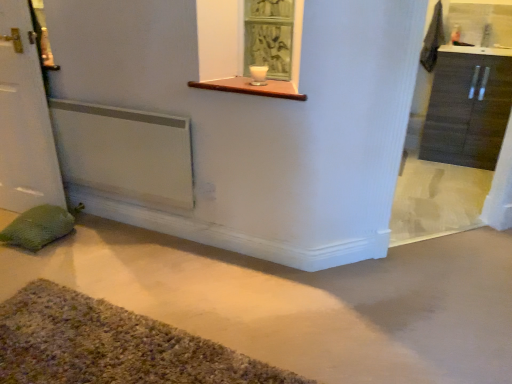
Question: From a real-world perspective, is white ceramic bowl at upper center physically below multicolored shaggy bath mat at lower left?

Choices:
 (A) no
 (B) yes

Answer: (A)

Question: Considering the relative sizes of white ceramic bowl at upper center and multicolored shaggy bath mat at lower left in the image provided, is white ceramic bowl at upper center thinner than multicolored shaggy bath mat at lower left?

Choices:
 (A) yes
 (B) no

Answer: (A)

Question: Is white ceramic bowl at upper center behind multicolored shaggy bath mat at lower left?

Choices:
 (A) no
 (B) yes

Answer: (B)

Question: From a real-world perspective, is white ceramic bowl at upper center on multicolored shaggy bath mat at lower left?

Choices:
 (A) no
 (B) yes

Answer: (B)

Question: Is white ceramic bowl at upper center completely or partially outside of multicolored shaggy bath mat at lower left?

Choices:
 (A) no
 (B) yes

Answer: (B)

Question: Is white ceramic bowl at upper center to the left of multicolored shaggy bath mat at lower left from the viewer's perspective?

Choices:
 (A) yes
 (B) no

Answer: (B)

Question: Is wooden at upper center facing away from white ceramic bowl at upper center?

Choices:
 (A) yes
 (B) no

Answer: (B)

Question: Is wooden at upper center at the right side of white ceramic bowl at upper center?

Choices:
 (A) yes
 (B) no

Answer: (A)

Question: Considering the relative sizes of wooden at upper center and white ceramic bowl at upper center in the image provided, is wooden at upper center bigger than white ceramic bowl at upper center?

Choices:
 (A) yes
 (B) no

Answer: (A)

Question: Can you confirm if wooden at upper center is positioned to the left of white ceramic bowl at upper center?

Choices:
 (A) yes
 (B) no

Answer: (B)

Question: From the image's perspective, would you say wooden at upper center is positioned over white ceramic bowl at upper center?

Choices:
 (A) no
 (B) yes

Answer: (A)

Question: Can you confirm if wooden at upper center is thinner than white ceramic bowl at upper center?

Choices:
 (A) yes
 (B) no

Answer: (B)

Question: From a real-world perspective, is white matte door at left over wooden at upper center?

Choices:
 (A) no
 (B) yes

Answer: (A)